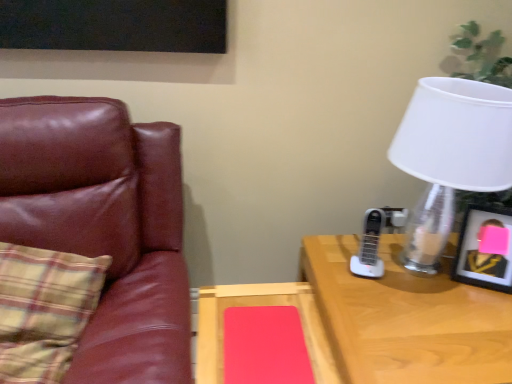
The width and height of the screenshot is (512, 384). What are the coordinates of `free space above wooden desk at right (from a real-world perspective)` in the screenshot? It's located at (426, 304).